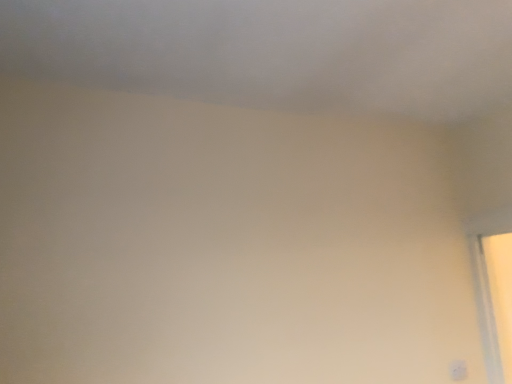
What do you see at coordinates (274, 51) in the screenshot? Image resolution: width=512 pixels, height=384 pixels. I see `white matte cloud at upper center` at bounding box center [274, 51].

What is the approximate width of white matte cloud at upper center?

It is 6.97 feet.

Where is `white matte cloud at upper center`? white matte cloud at upper center is located at coordinates (274, 51).

Locate an element on the screen. This screenshot has width=512, height=384. white matte cloud at upper center is located at coordinates (274, 51).